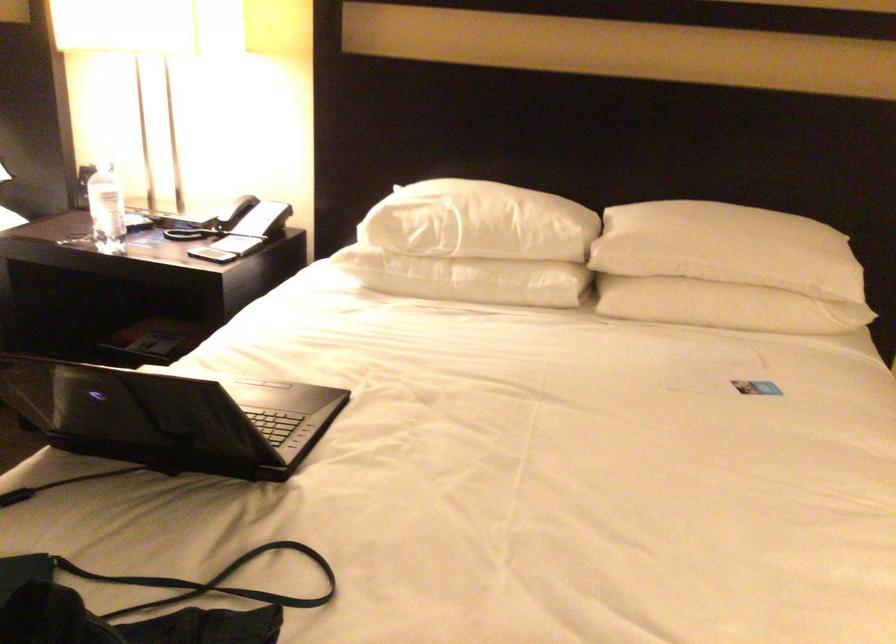
Find where to lift the telephone handset. Please return your answer as a coordinate pair (x, y).

(238, 221)